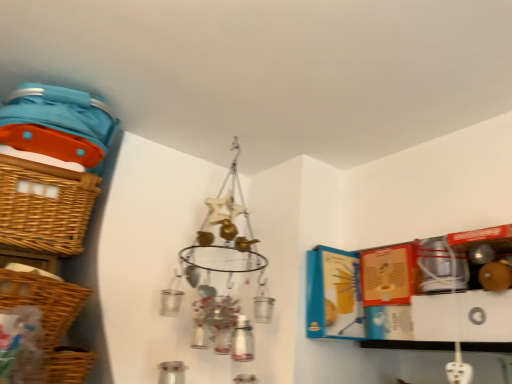
Question: Is woven brown basket at left, which is the third basket from bottom to top, smaller than woven brown basket at lower left, the first basket in the bottom-to-top sequence?

Choices:
 (A) yes
 (B) no

Answer: (B)

Question: Can we say woven brown basket at left, which is the third basket from bottom to top, lies outside woven brown basket at lower left, the first basket in the bottom-to-top sequence?

Choices:
 (A) no
 (B) yes

Answer: (B)

Question: Does woven brown basket at left, which is the third basket from bottom to top, have a greater width compared to woven brown basket at lower left, which is the 3th basket from top to bottom?

Choices:
 (A) no
 (B) yes

Answer: (B)

Question: Is woven brown basket at left, marked as the first basket in a top-to-bottom arrangement, at the left side of woven brown basket at lower left, which is the 3th basket from top to bottom?

Choices:
 (A) yes
 (B) no

Answer: (A)

Question: Is woven brown basket at left, which is the third basket from bottom to top, looking in the opposite direction of woven brown basket at lower left, which is the 3th basket from top to bottom?

Choices:
 (A) yes
 (B) no

Answer: (B)

Question: Can you confirm if woven brown basket at left, which is the third basket from bottom to top, is taller than woven brown basket at lower left, the first basket in the bottom-to-top sequence?

Choices:
 (A) yes
 (B) no

Answer: (A)

Question: Is woven brown basket at left, placed as the second basket when sorted from top to bottom, at the left side of woven brown basket at left, marked as the first basket in a top-to-bottom arrangement?

Choices:
 (A) yes
 (B) no

Answer: (B)

Question: Are woven brown basket at left, placed as the second basket when sorted from top to bottom, and woven brown basket at left, which is the third basket from bottom to top, beside each other?

Choices:
 (A) yes
 (B) no

Answer: (B)

Question: Is woven brown basket at left, the second basket when ordered from bottom to top, bigger than woven brown basket at left, marked as the first basket in a top-to-bottom arrangement?

Choices:
 (A) yes
 (B) no

Answer: (B)

Question: Does woven brown basket at left, the second basket when ordered from bottom to top, have a greater height compared to woven brown basket at left, marked as the first basket in a top-to-bottom arrangement?

Choices:
 (A) yes
 (B) no

Answer: (B)

Question: Is woven brown basket at left, the second basket when ordered from bottom to top, to the right of woven brown basket at left, which is the third basket from bottom to top, from the viewer's perspective?

Choices:
 (A) yes
 (B) no

Answer: (A)

Question: From the image's perspective, is woven brown basket at left, the second basket when ordered from bottom to top, above woven brown basket at left, marked as the first basket in a top-to-bottom arrangement?

Choices:
 (A) no
 (B) yes

Answer: (A)

Question: Is woven brown basket at lower left, the first basket in the bottom-to-top sequence, wider than woven brown basket at left, marked as the first basket in a top-to-bottom arrangement?

Choices:
 (A) yes
 (B) no

Answer: (B)